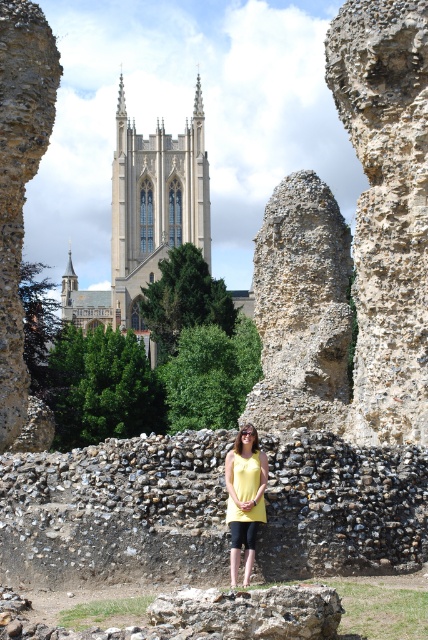
Is light beige stone church at upper center bigger than yellow fabric top at center?

Yes, light beige stone church at upper center is bigger than yellow fabric top at center.

Can you confirm if light beige stone church at upper center is smaller than yellow fabric top at center?

Actually, light beige stone church at upper center might be larger than yellow fabric top at center.

What are the coordinates of `light beige stone church at upper center` in the screenshot? It's located at (145, 218).

At what (x,y) coordinates should I click in order to perform the action: click on light beige stone church at upper center. Please return your answer as a coordinate pair (x, y). Looking at the image, I should click on (145, 218).